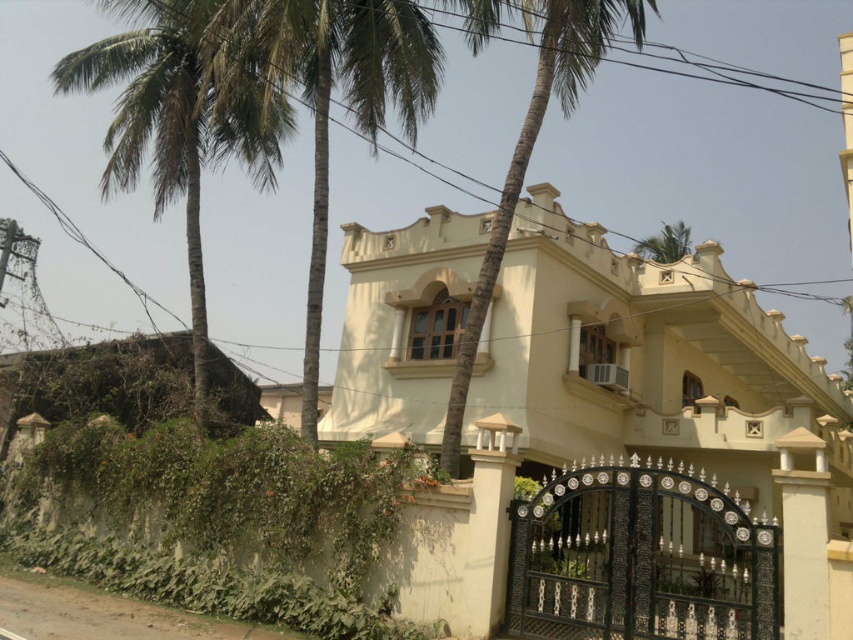
Which of these two, green leafy palm tree at left or green leafy palm tree at center, stands shorter?

With less height is green leafy palm tree at center.

Which is behind, point (167, 6) or point (570, 102)?

Point (570, 102)

The width and height of the screenshot is (853, 640). I want to click on green leafy palm tree at left, so click(x=180, y=122).

Can you confirm if green leafy palm tree at upper left is thinner than green leafy palm tree at center?

No, green leafy palm tree at upper left is not thinner than green leafy palm tree at center.

Does point (323, 264) come closer to viewer compared to point (569, 84)?

Yes, point (323, 264) is in front of point (569, 84).

At what (x,y) coordinates should I click in order to perform the action: click on green leafy palm tree at upper left. Please return your answer as a coordinate pair (x, y). The width and height of the screenshot is (853, 640). Looking at the image, I should click on (344, 97).

I want to click on green leafy palm tree at upper left, so click(344, 97).

Who is positioned more to the right, green leafy palm tree at left or green leafy palm tree at upper left?

green leafy palm tree at upper left

Can you confirm if green leafy palm tree at left is smaller than green leafy palm tree at upper left?

No, green leafy palm tree at left is not smaller than green leafy palm tree at upper left.

Is point (178, 179) positioned after point (424, 113)?

No, (178, 179) is in front of (424, 113).

This screenshot has height=640, width=853. What are the coordinates of `green leafy palm tree at left` in the screenshot? It's located at (180, 122).